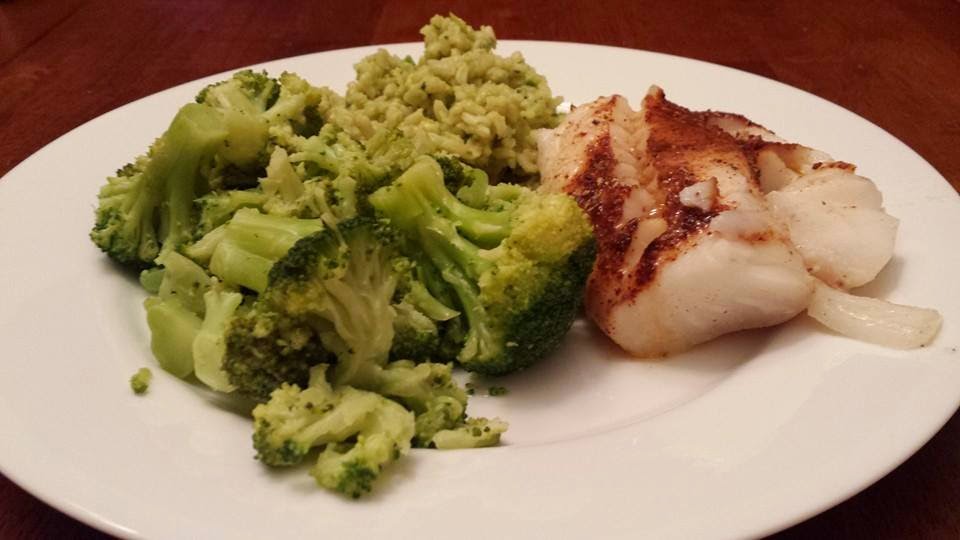
In order to click on plate in this screenshot , I will do `click(637, 450)`.